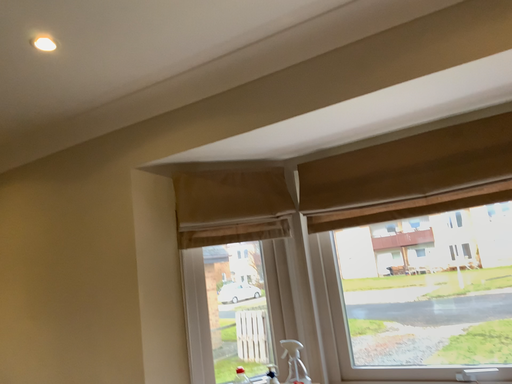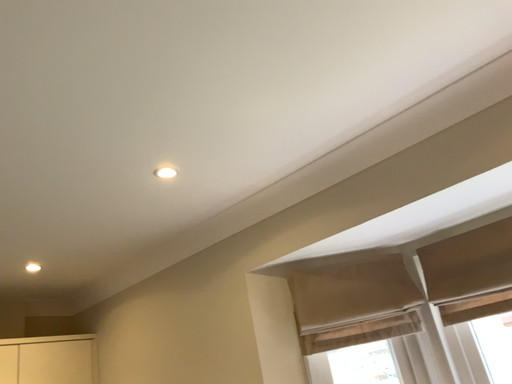
Question: Which way did the camera rotate in the video?

Choices:
 (A) rotated right
 (B) rotated left

Answer: (B)